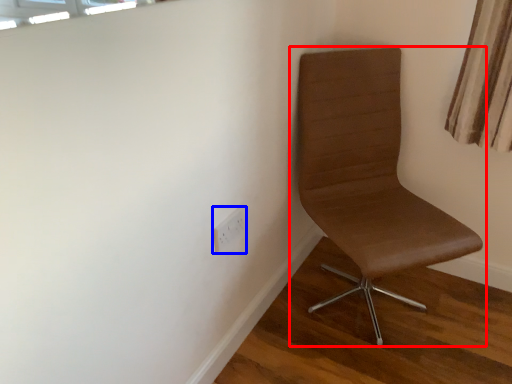
Question: Which point is further to the camera, chair (highlighted by a red box) or electric outlet (highlighted by a blue box)?

Choices:
 (A) chair
 (B) electric outlet

Answer: (B)